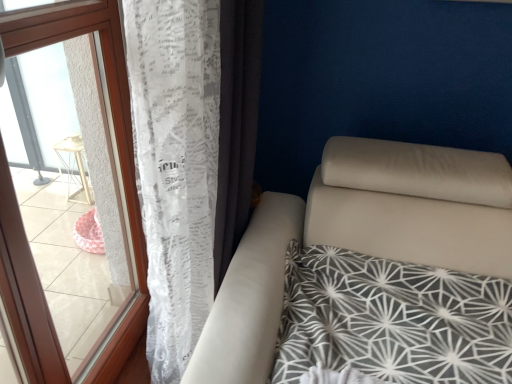
Question: Based on their sizes in the image, would you say white lace curtain at left, which is the second curtain in left-to-right order, is bigger or smaller than white lace curtain at left, positioned as the first curtain in left-to-right order?

Choices:
 (A) small
 (B) big

Answer: (A)

Question: Considering the positions of white lace curtain at left, the first curtain positioned from the right, and white lace curtain at left, which ranks as the second curtain in right-to-left order, in the image, is white lace curtain at left, the first curtain positioned from the right, wider or thinner than white lace curtain at left, which ranks as the second curtain in right-to-left order,?

Choices:
 (A) wide
 (B) thin

Answer: (B)

Question: Which object is positioned closest to the white lace curtain at left, the first curtain positioned from the right?

Choices:
 (A) white lace curtain at left, which ranks as the second curtain in right-to-left order
 (B) transparent plastic window at left

Answer: (A)

Question: Which object is positioned closest to the white lace curtain at left, which is the second curtain in left-to-right order?

Choices:
 (A) transparent plastic window at left
 (B) white lace curtain at left, positioned as the first curtain in left-to-right order

Answer: (B)